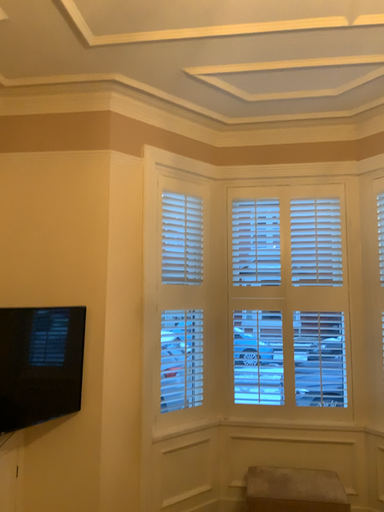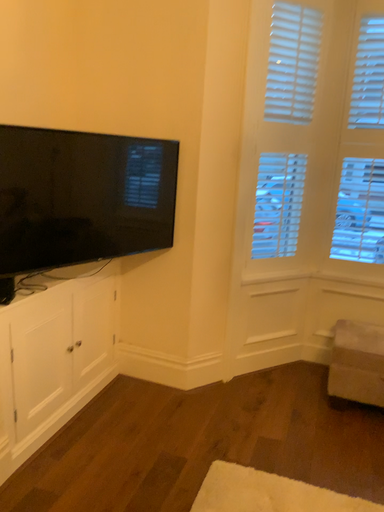
Question: How did the camera likely rotate when shooting the video?

Choices:
 (A) rotated left
 (B) rotated right

Answer: (A)